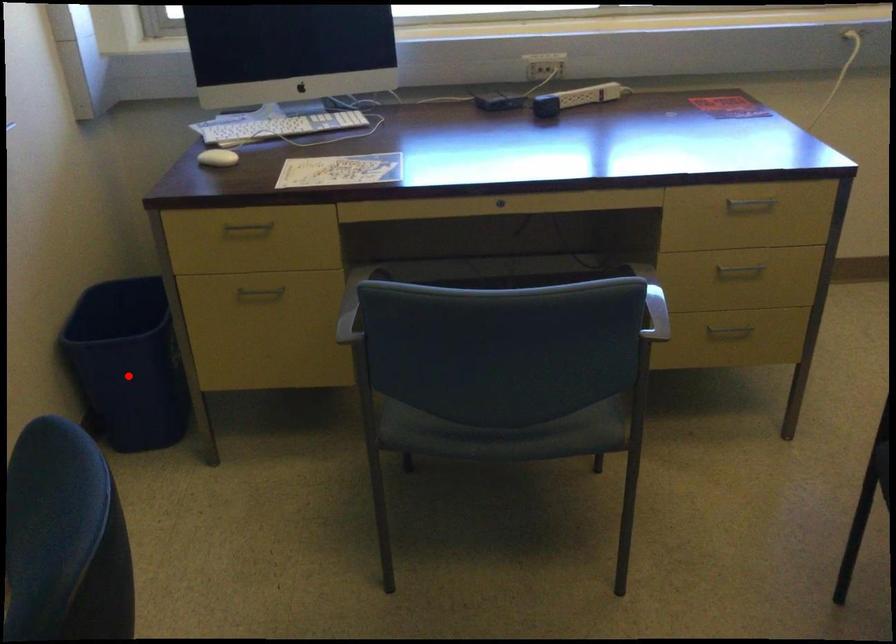
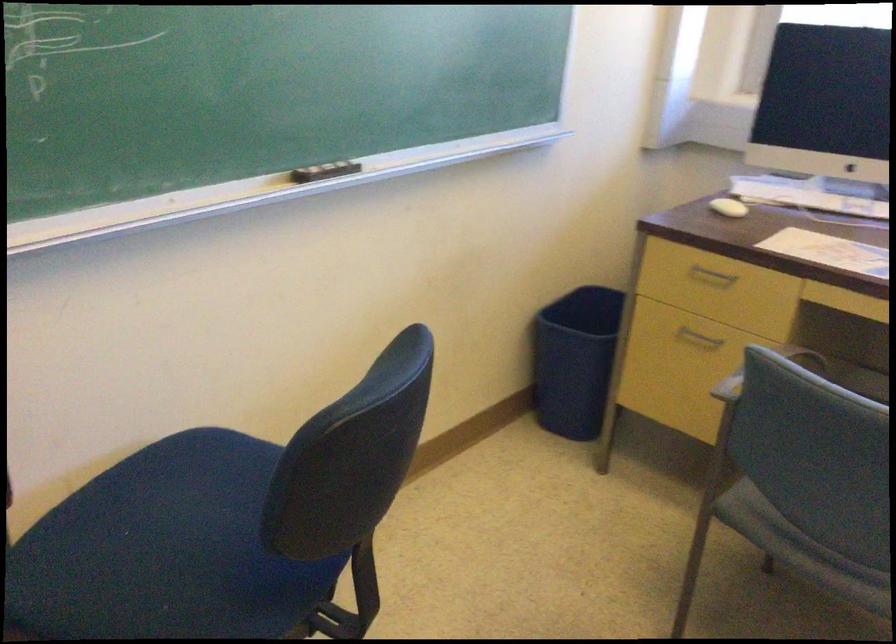
Question: I am providing you with two images of the same scene from different viewpoints. A red point is shown in image1. For the corresponding object point in image2, is it positioned nearer or farther from the camera?

Choices:
 (A) Nearer
 (B) Farther

Answer: (B)